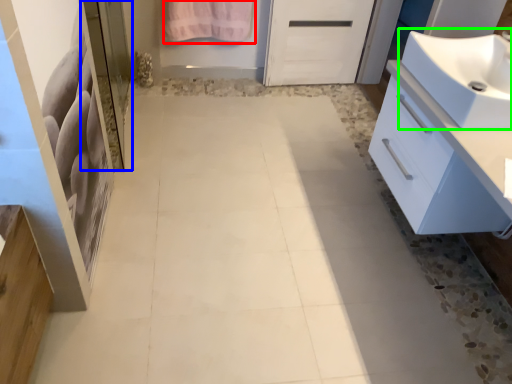
Question: Considering the real-world distances, which object is closest to bath towel (highlighted by a red box)? screen door (highlighted by a blue box) or sink (highlighted by a green box).

Choices:
 (A) screen door
 (B) sink

Answer: (A)